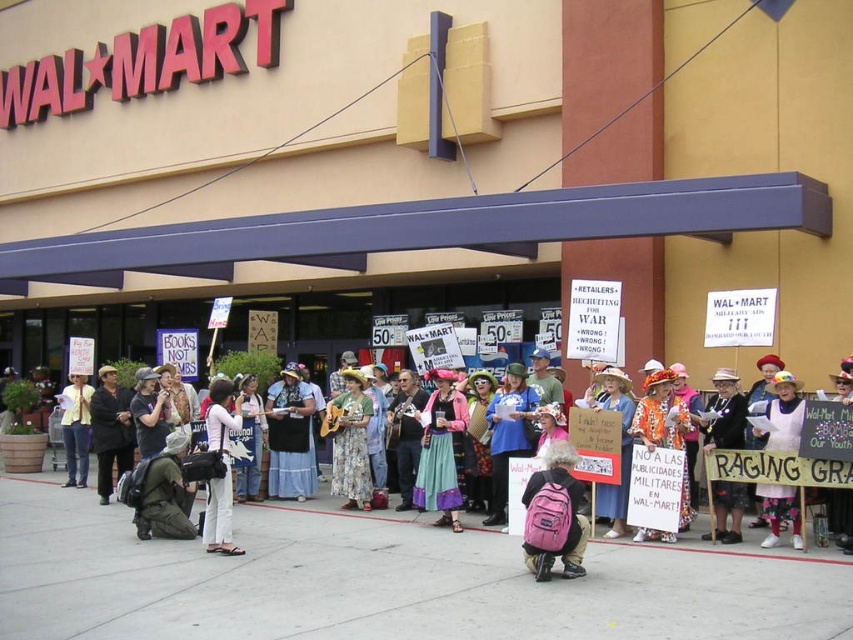
Question: Which of the following is the farthest from the observer?

Choices:
 (A) (659, 380)
 (B) (773, 481)
 (C) (735, 524)
 (D) (770, 497)

Answer: (A)

Question: Is multicolored fabric dress at center above white paper sign at center?

Choices:
 (A) no
 (B) yes

Answer: (A)

Question: Which point is closer to the camera taking this photo?

Choices:
 (A) (842, 444)
 (B) (57, 397)
 (C) (535, 554)

Answer: (C)

Question: Which of the following is the farthest from the observer?

Choices:
 (A) multicolored fabric dress at center
 (B) pink fabric skirt at center

Answer: (B)

Question: Does blue cotton dress at center have a larger size compared to black fabric jacket at center?

Choices:
 (A) no
 (B) yes

Answer: (A)

Question: Can you confirm if pink fabric backpack at lower center is positioned to the left of floral dress at center?

Choices:
 (A) yes
 (B) no

Answer: (B)